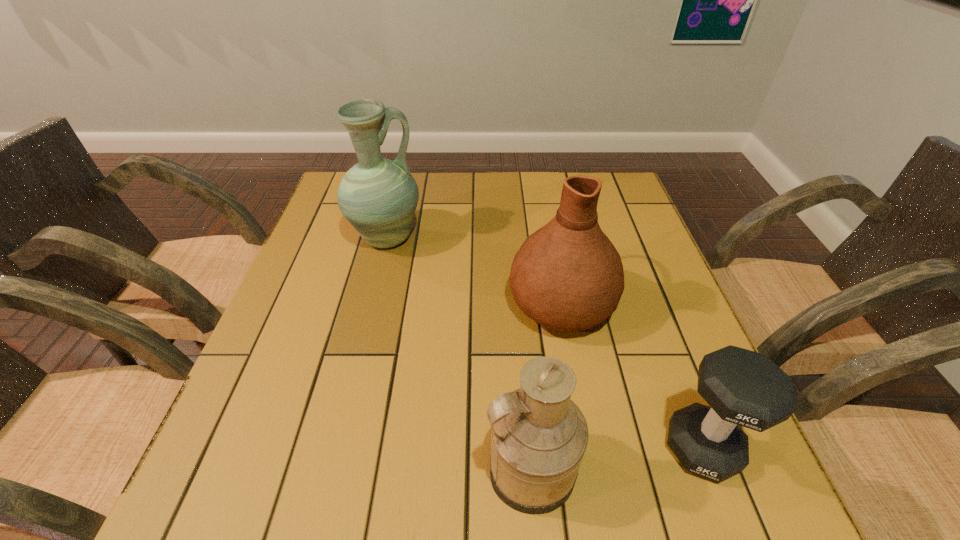
What are the coordinates of `free area in between the second farthest object and the rightmost object` in the screenshot? It's located at (632, 375).

The image size is (960, 540). What are the coordinates of `vacant area between the dumbbell and the leftmost object` in the screenshot? It's located at (544, 343).

Where is `vacant point located between the shortest pitcher and the rightmost object`? Image resolution: width=960 pixels, height=540 pixels. vacant point located between the shortest pitcher and the rightmost object is located at coordinates (616, 458).

You are a GUI agent. You are given a task and a screenshot of the screen. Output one action in this format:
    pyautogui.click(x=<x>, y=<y>)
    Task: Click on the empty space between the second nearest pitcher and the shortest object
    
    Given the screenshot: What is the action you would take?
    pyautogui.click(x=632, y=375)

I want to click on the third closest object to the dumbbell, so click(378, 196).

Image resolution: width=960 pixels, height=540 pixels. What are the coordinates of `the second closest object to the shortest object` in the screenshot? It's located at (539, 436).

Point out which pitcher is positioned as the third nearest to the dumbbell. Please provide its 2D coordinates. Your answer should be formatted as a tuple, i.e. [(x, y)], where the tuple contains the x and y coordinates of a point satisfying the conditions above.

[(378, 196)]

At what (x,y) coordinates should I click in order to perform the action: click on pitcher that stands as the closest to the shortest pitcher. Please return your answer as a coordinate pair (x, y). The height and width of the screenshot is (540, 960). Looking at the image, I should click on (568, 276).

The height and width of the screenshot is (540, 960). Find the location of `vacant space that satisfies the following two spatial constraints: 1. on the back side of the dumbbell; 2. on the right side of the second shortest object`. vacant space that satisfies the following two spatial constraints: 1. on the back side of the dumbbell; 2. on the right side of the second shortest object is located at coordinates (529, 448).

Locate an element on the screen. Image resolution: width=960 pixels, height=540 pixels. vacant point that satisfies the following two spatial constraints: 1. on the side of the second farthest object with the handle; 2. on the handle side of the leftmost pitcher is located at coordinates (549, 239).